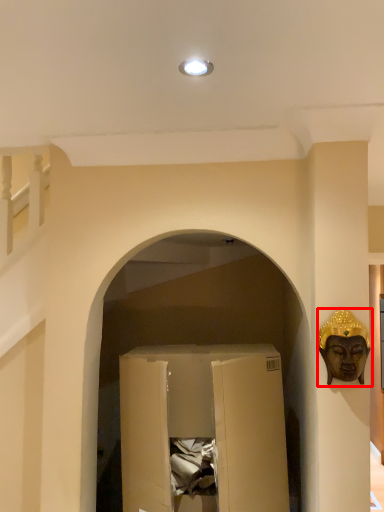
Question: From the image, what is the correct spatial relationship of person (annotated by the red box) in relation to wide?

Choices:
 (A) left
 (B) right

Answer: (B)